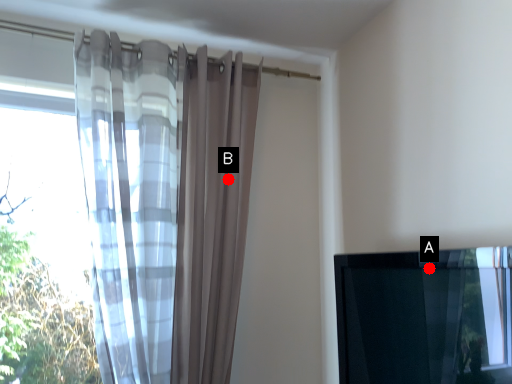
Question: Two points are circled on the image, labeled by A and B beside each circle. Among these points, which one is nearest to the camera?

Choices:
 (A) A is closer
 (B) B is closer

Answer: (A)